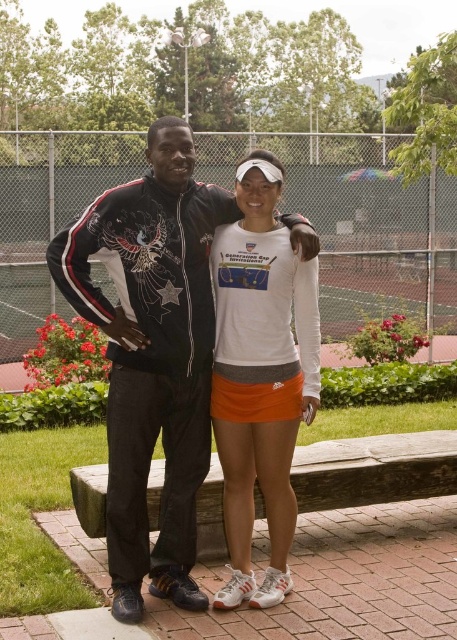
Question: Which of the following is the closest to the observer?

Choices:
 (A) (242, 492)
 (B) (180, 344)

Answer: (B)

Question: Which of the following is the farthest from the observer?

Choices:
 (A) matte black jacket at center
 (B) white matte tennis skirt at center

Answer: (B)

Question: Is matte black jacket at center to the left of white matte tennis skirt at center from the viewer's perspective?

Choices:
 (A) no
 (B) yes

Answer: (B)

Question: Is matte black jacket at center bigger than white matte tennis skirt at center?

Choices:
 (A) no
 (B) yes

Answer: (B)

Question: In this image, where is matte black jacket at center located relative to white matte tennis skirt at center?

Choices:
 (A) right
 (B) left

Answer: (B)